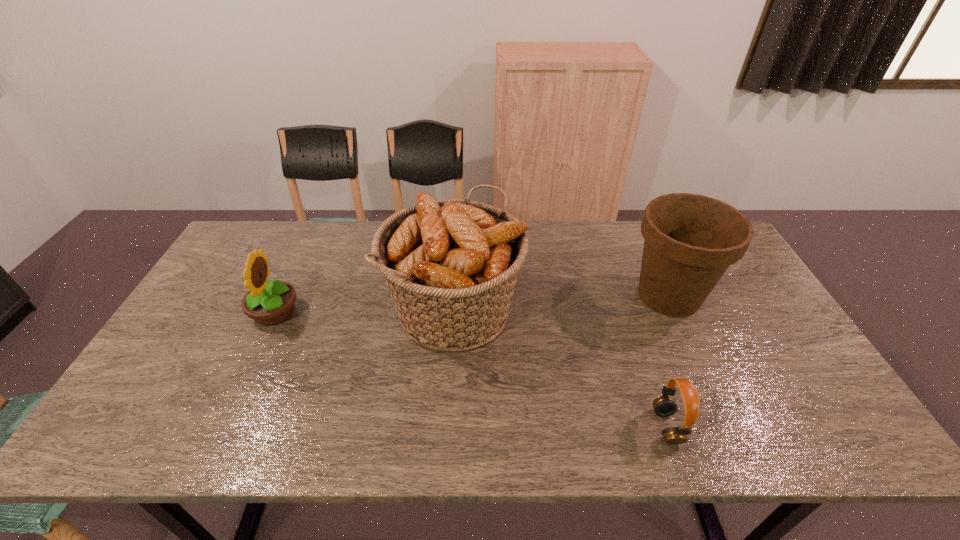
Locate which object is the second closest to the basket. Please provide its 2D coordinates. Your answer should be formatted as a tuple, i.e. [(x, y)], where the tuple contains the x and y coordinates of a point satisfying the conditions above.

[(664, 406)]

Identify the location of vacant position in the image that satisfies the following two spatial constraints: 1. on the front side of the flowerpot; 2. on the face of the leftmost object. (677, 313).

At what (x,y) coordinates should I click in order to perform the action: click on blank space that satisfies the following two spatial constraints: 1. on the front side of the basket; 2. on the face of the leftmost object. Please return your answer as a coordinate pair (x, y). The image size is (960, 540). Looking at the image, I should click on (454, 313).

I want to click on free space that satisfies the following two spatial constraints: 1. on the back side of the flowerpot; 2. on the left side of the basket, so click(x=455, y=296).

This screenshot has height=540, width=960. I want to click on vacant space that satisfies the following two spatial constraints: 1. on the front side of the flowerpot; 2. on the face of the third tallest object, so click(677, 313).